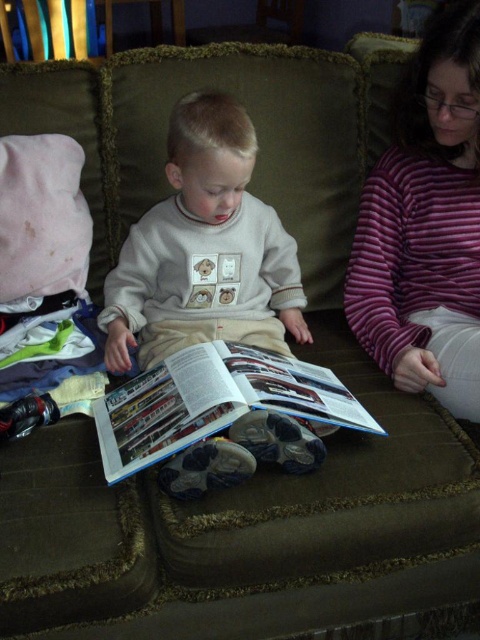
What is the object located at the coordinates point (204, 250) in the image?

The object located at point (204, 250) is the light gray cotton sweater at center.

You are designing a display stand for a childrens clothing store. The stand needs to showcase both the light gray cotton sweater at center and the purple striped sweater at upper right. Since the stand has limited vertical space, which sweater should be placed lower to ensure both are visible?

The light gray cotton sweater at center is shorter than the purple striped sweater at upper right, so placing the shorter light gray cotton sweater at center on the lower shelf and the taller purple striped sweater at upper right on the higher shelf will ensure both are visible without blocking each other.